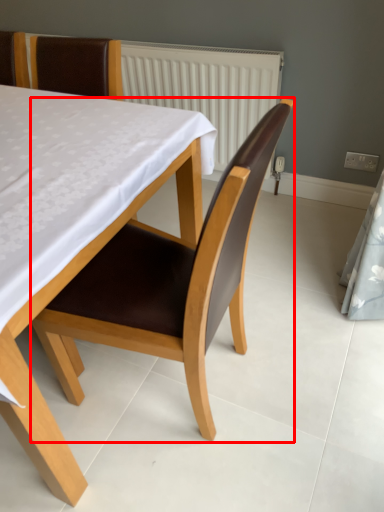
Question: In this image, where is chair (annotated by the red box) located relative to chair?

Choices:
 (A) right
 (B) left

Answer: (A)